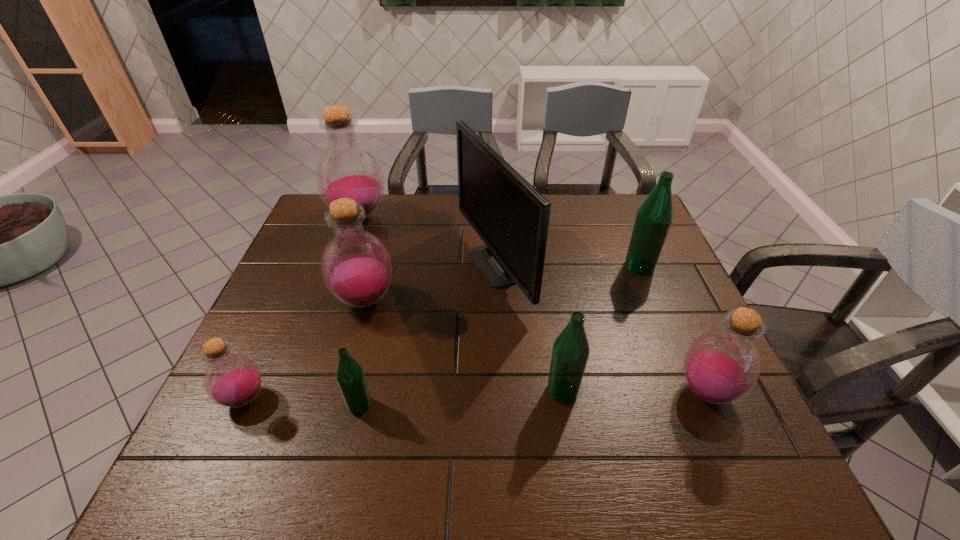
Image resolution: width=960 pixels, height=540 pixels. In order to click on vacant point located between the smallest green bottle and the second farthest bottle in this screenshot , I will do `click(499, 335)`.

The height and width of the screenshot is (540, 960). I want to click on empty space that is in between the second farthest bottle and the rightmost purple bottle, so click(x=673, y=329).

You are a GUI agent. You are given a task and a screenshot of the screen. Output one action in this format:
    pyautogui.click(x=<x>, y=<y>)
    Task: Click on the unoccupied area between the fifth nearest bottle and the smallest green bottle
    
    Given the screenshot: What is the action you would take?
    pyautogui.click(x=362, y=353)

The image size is (960, 540). Identify the location of vacant space that is in between the third smallest purple bottle and the computer monitor. (429, 283).

In order to click on free spot between the leftmost green bottle and the smallest purple bottle in this screenshot , I will do (x=302, y=401).

Where is `unoccupied area between the smallest purple bottle and the computer monitor`? Image resolution: width=960 pixels, height=540 pixels. unoccupied area between the smallest purple bottle and the computer monitor is located at coordinates (370, 332).

At what (x,y) coordinates should I click in order to perform the action: click on vacant space that is in between the computer monitor and the smallest green bottle. Please return your answer as a coordinate pair (x, y). The width and height of the screenshot is (960, 540). Looking at the image, I should click on (426, 335).

Find the location of a particular element. empty space between the smallest purple bottle and the farthest green bottle is located at coordinates (443, 332).

Where is `free space between the smallest purple bottle and the farthest purple bottle`? The height and width of the screenshot is (540, 960). free space between the smallest purple bottle and the farthest purple bottle is located at coordinates (301, 307).

Identify which object is the third nearest to the farthest bottle. Please provide its 2D coordinates. Your answer should be formatted as a tuple, i.e. [(x, y)], where the tuple contains the x and y coordinates of a point satisfying the conditions above.

[(232, 380)]